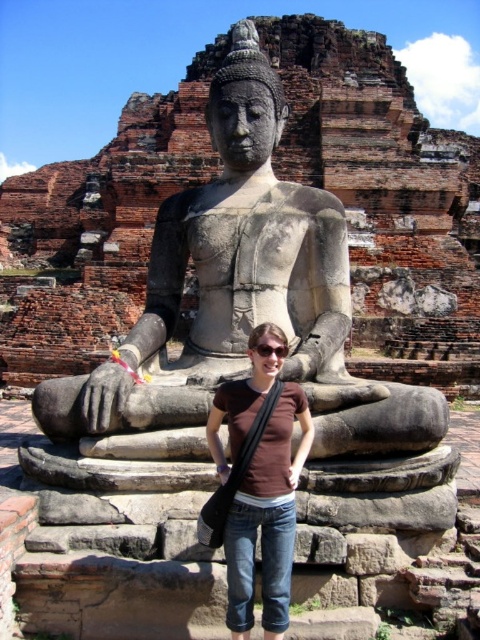
You are a tourist visiting the ancient site and want to take a photo of yourself with the gray stone statue at center and the brown cotton shirt at center. Since you want the statue to appear on your left side in the photo, should you position yourself to the left or right of the statue?

The gray stone statue at center is to the left of brown cotton shirt at center. To have the statue appear on your left side in the photo, you should position yourself to the right of the statue.

You are a photographer planning to take a photo of the gray stone statue at center and the brown cotton shirt at center. Which object should you focus on first if you want to capture both in sharp focus?

The gray stone statue at center is above the brown cotton shirt at center, so focusing on the gray stone statue at center first would ensure both are in sharp focus as it is closer to the camera.

You are a photographer trying to capture a photo of the gray stone statue at center and the brown cotton shirt at center. Which object should you focus on first if you want to ensure both are in sharp focus, considering their sizes?

The gray stone statue at center is taller than the brown cotton shirt at center, so you should focus on the gray stone statue at center first to ensure both are in sharp focus.